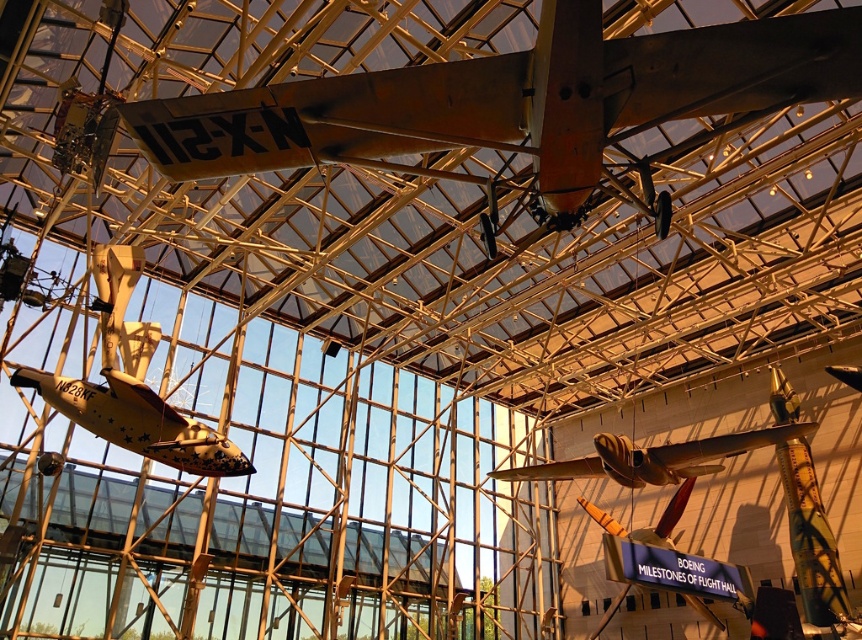
Question: Which point is farther to the camera?

Choices:
 (A) (109, 435)
 (B) (510, 477)
 (C) (645, 122)

Answer: (B)

Question: In this image, where is yellow matte airplane at center located relative to shiny silver airplane at center?

Choices:
 (A) right
 (B) left

Answer: (B)

Question: Is yellow matte airplane at center to the right of shiny silver airplane at center from the viewer's perspective?

Choices:
 (A) no
 (B) yes

Answer: (A)

Question: Which of the following is the farthest from the observer?

Choices:
 (A) (569, 460)
 (B) (189, 452)
 (C) (825, 38)

Answer: (A)

Question: Is the position of yellow matte airplane at center less distant than that of shiny silver airplane at center?

Choices:
 (A) no
 (B) yes

Answer: (B)

Question: Which object is positioned closest to the shiny silver airplane at center?

Choices:
 (A) yellow matte airplane at center
 (B) rusty metal airplane at upper center

Answer: (A)